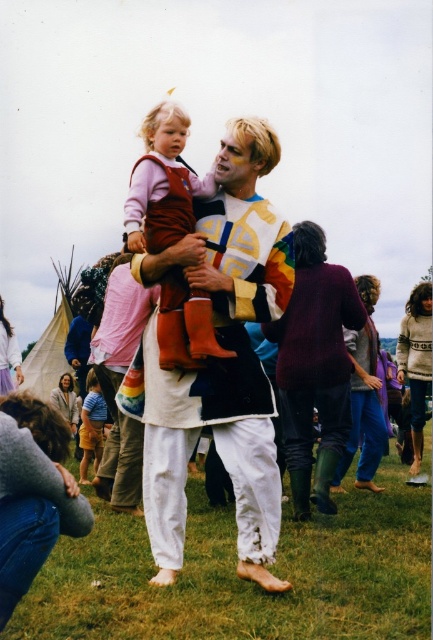
Question: Which object appears farthest from the camera in this image?

Choices:
 (A) white cotton pants at center
 (B) gray fabric shoulder at lower left
 (C) striped cotton shirt at lower left
 (D) velvet maroon boots at center

Answer: (C)

Question: Which of the following is the farthest from the observer?

Choices:
 (A) striped cotton shirt at lower left
 (B) white cotton pants at center

Answer: (A)

Question: Which of the following is the farthest from the observer?

Choices:
 (A) gray fabric shoulder at lower left
 (B) white cotton pants at center
 (C) striped cotton shirt at lower left
 (D) velvet maroon boots at center

Answer: (C)

Question: Is gray fabric shoulder at lower left wider than striped cotton shirt at lower left?

Choices:
 (A) no
 (B) yes

Answer: (B)

Question: Is white cotton pants at center above striped cotton shirt at lower left?

Choices:
 (A) yes
 (B) no

Answer: (A)

Question: Is gray fabric shoulder at lower left bigger than striped cotton shirt at lower left?

Choices:
 (A) no
 (B) yes

Answer: (B)